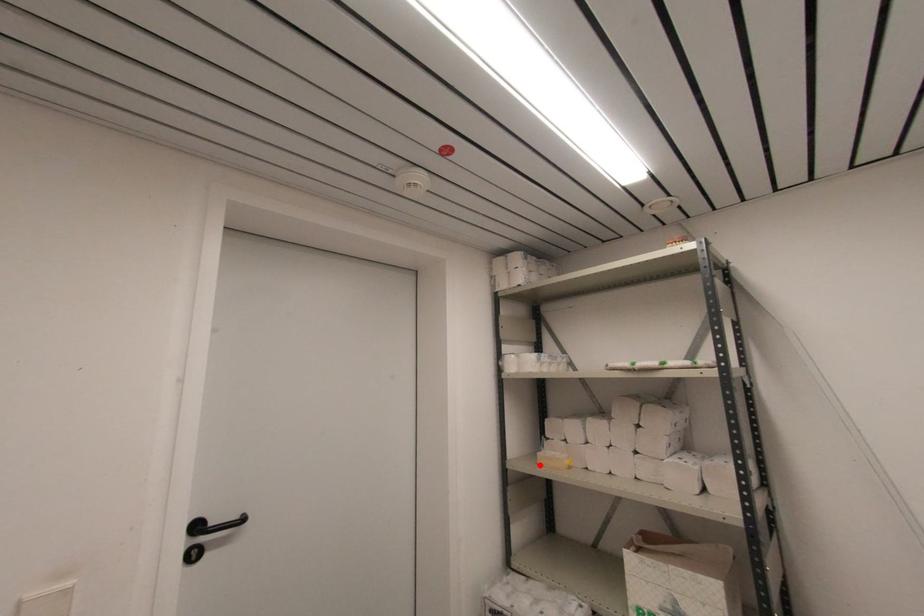
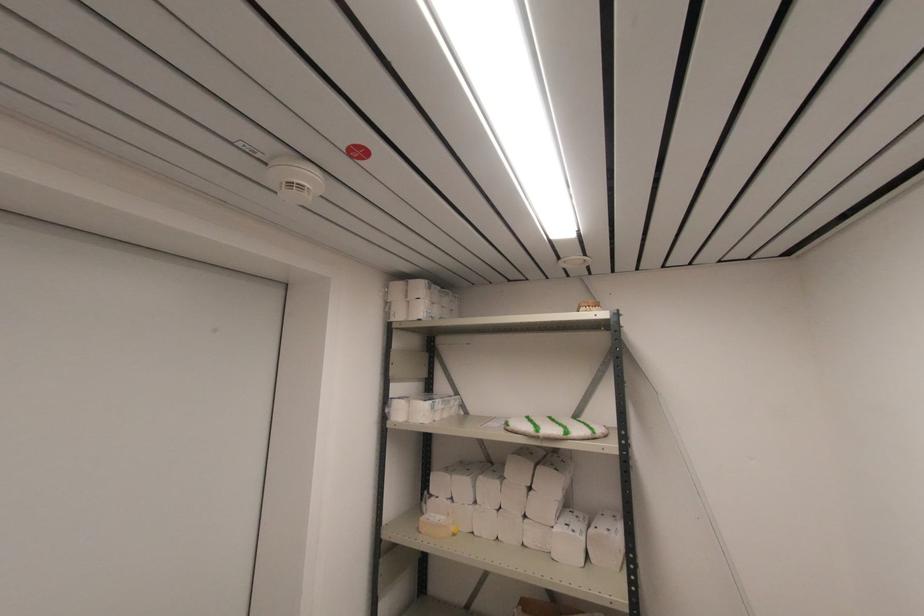
Locate, in the second image, the point that corresponds to the highlighted location in the first image.

(420, 533)